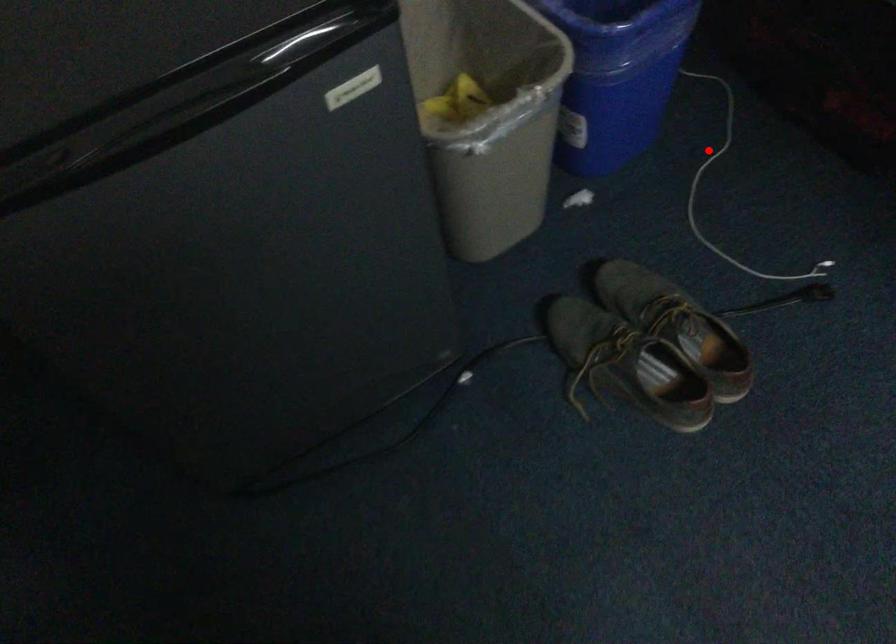
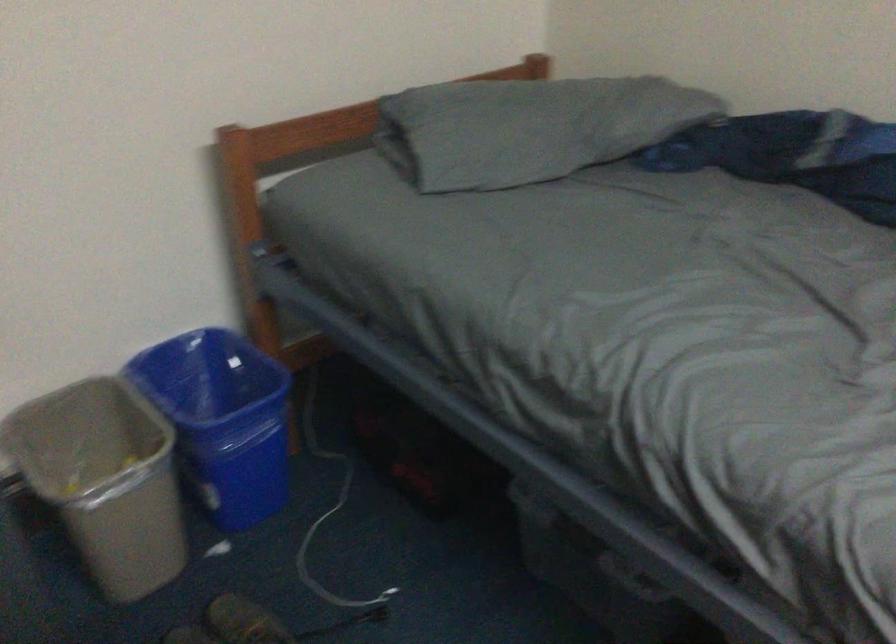
Question: I am providing you with two images of the same scene from different viewpoints. Image1 has a red point marked. In image2, the corresponding 3D location appears at what relative position? Reply with the corresponding letter.

Choices:
 (A) Closer
 (B) Farther

Answer: (B)